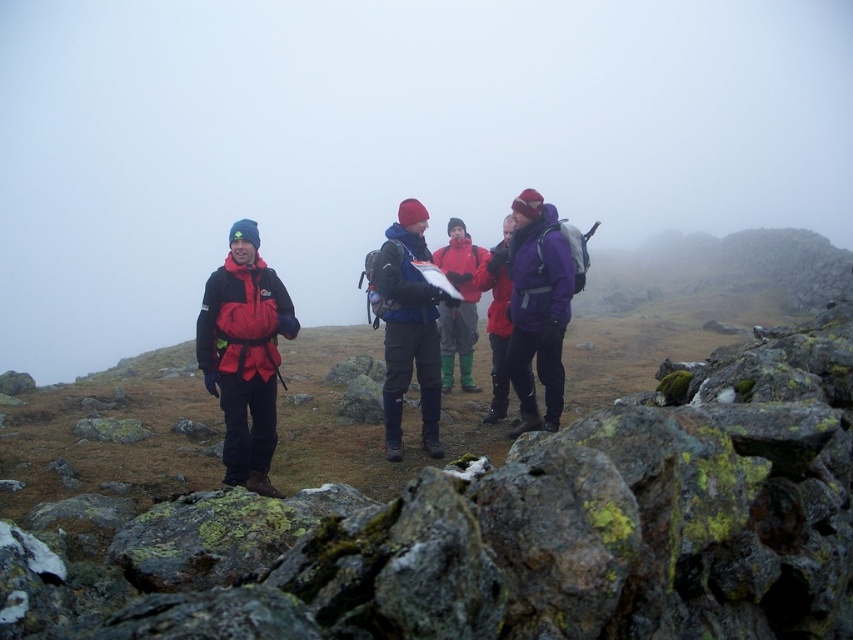
You are a hiker planning to wear either the purple fleece jacket at center or the red waterproof jacket at center for a cold, misty mountain hike. Based on their appearance in the image, which jacket might be more suitable for staying warm and dry?

The red waterproof jacket at center is taller than the purple fleece jacket at center, suggesting it has a longer design which could provide better coverage and protection against the elements, making it more suitable for staying warm and dry in the misty mountain conditions.

You are a hiker trying to navigate through the misty mountain path. You see two markers labeled as point 1 and point 2. Point 1 is at coordinates point (143,529) and point 2 is at point (421,259). Based on the scene description, which point is closer to you?

Point 1 at coordinates point (143,529) is closer to you because it is in front of point 2 at point (421,259).